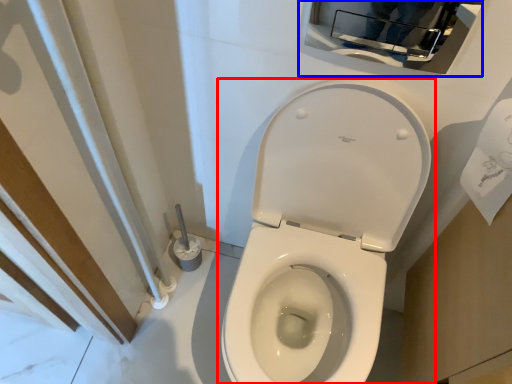
Question: Which object is further to the camera taking this photo, toilet (highlighted by a red box) or medicine cabinet (highlighted by a blue box)?

Choices:
 (A) toilet
 (B) medicine cabinet

Answer: (B)